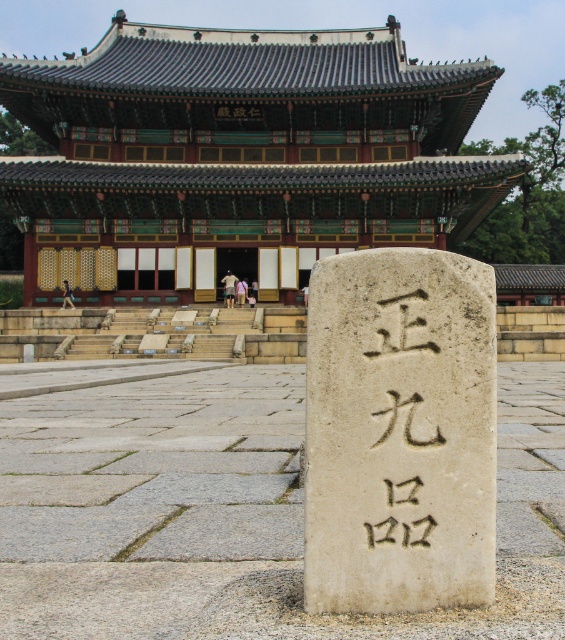
Is white stone marker at center taller than black stone carving at center?

No, white stone marker at center is not taller than black stone carving at center.

Describe the element at coordinates (234, 513) in the screenshot. I see `white stone marker at center` at that location.

Find the location of `white stone marker at center`. white stone marker at center is located at coordinates (234, 513).

Is green wooden palace at upper center smaller than black stone carving at center?

Incorrect, green wooden palace at upper center is not smaller in size than black stone carving at center.

Does green wooden palace at upper center appear on the right side of black stone carving at center?

In fact, green wooden palace at upper center is to the left of black stone carving at center.

Is point (80, 83) farther from camera compared to point (371, 413)?

Yes.

Identify the location of green wooden palace at upper center. (237, 157).

Is the position of green wooden palace at upper center less distant than that of white stone marker at center?

No.

What do you see at coordinates (237, 157) in the screenshot? This screenshot has width=565, height=640. I see `green wooden palace at upper center` at bounding box center [237, 157].

Locate an element on the screen. The width and height of the screenshot is (565, 640). green wooden palace at upper center is located at coordinates (237, 157).